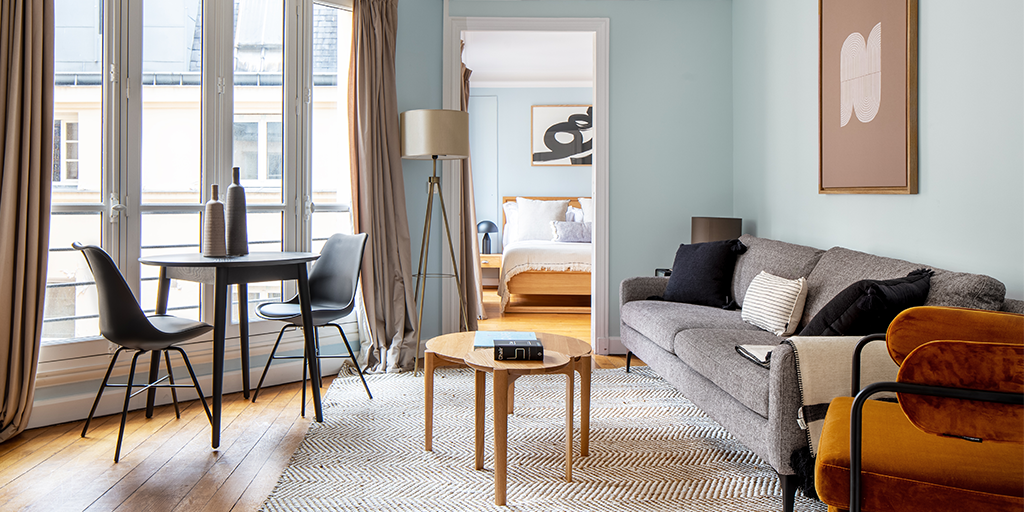
The width and height of the screenshot is (1024, 512). What are the coordinates of `curtains` in the screenshot? It's located at (381, 103), (27, 156).